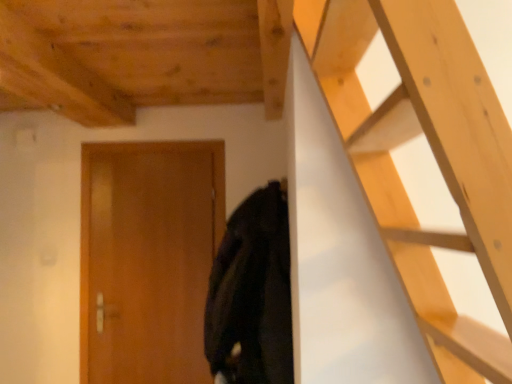
Question: Is wooden door at center surrounding wooden at upper right?

Choices:
 (A) yes
 (B) no

Answer: (B)

Question: Could you tell me if wooden door at center is facing wooden at upper right?

Choices:
 (A) no
 (B) yes

Answer: (A)

Question: Can you confirm if wooden door at center is thinner than wooden at upper right?

Choices:
 (A) no
 (B) yes

Answer: (B)

Question: Does wooden door at center appear on the left side of wooden at upper right?

Choices:
 (A) yes
 (B) no

Answer: (A)

Question: From the image's perspective, is wooden door at center below wooden at upper right?

Choices:
 (A) no
 (B) yes

Answer: (B)

Question: Is black matte coat at center spatially inside wooden at upper right, or outside of it?

Choices:
 (A) inside
 (B) outside

Answer: (B)

Question: From their relative heights in the image, would you say black matte coat at center is taller or shorter than wooden at upper right?

Choices:
 (A) short
 (B) tall

Answer: (A)

Question: Is black matte coat at center in front of or behind wooden at upper right in the image?

Choices:
 (A) front
 (B) behind

Answer: (B)

Question: In terms of size, does black matte coat at center appear bigger or smaller than wooden at upper right?

Choices:
 (A) small
 (B) big

Answer: (A)

Question: Would you say wooden door at center is to the left or to the right of black matte coat at center in the picture?

Choices:
 (A) right
 (B) left

Answer: (B)

Question: Is wooden door at center inside or outside of black matte coat at center?

Choices:
 (A) inside
 (B) outside

Answer: (B)

Question: From the image's perspective, is wooden door at center above or below black matte coat at center?

Choices:
 (A) below
 (B) above

Answer: (A)

Question: In terms of size, does wooden door at center appear bigger or smaller than black matte coat at center?

Choices:
 (A) big
 (B) small

Answer: (B)

Question: Considering their positions, is wooden at upper right located in front of or behind black matte coat at center?

Choices:
 (A) front
 (B) behind

Answer: (A)

Question: Which is correct: wooden at upper right is inside black matte coat at center, or outside of it?

Choices:
 (A) outside
 (B) inside

Answer: (A)